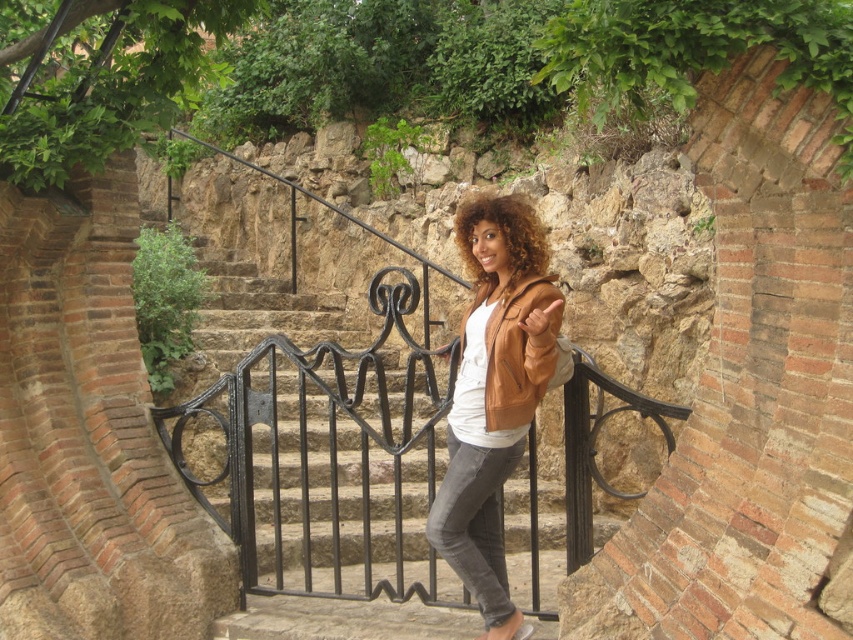
Question: Does brown leather jacket at center appear over curly golden hair at center?

Choices:
 (A) no
 (B) yes

Answer: (A)

Question: Can you confirm if brown leather jacket at center is positioned to the left of curly golden hair at center?

Choices:
 (A) no
 (B) yes

Answer: (B)

Question: Is brown leather jacket at center smaller than curly golden hair at center?

Choices:
 (A) yes
 (B) no

Answer: (B)

Question: Which of the following is the closest to the observer?

Choices:
 (A) (502, 224)
 (B) (526, 202)

Answer: (A)

Question: Which point is farther to the camera?

Choices:
 (A) (471, 355)
 (B) (538, 241)

Answer: (B)

Question: Which of the following is the farthest from the observer?

Choices:
 (A) curly golden hair at center
 (B) brown leather jacket at center

Answer: (A)